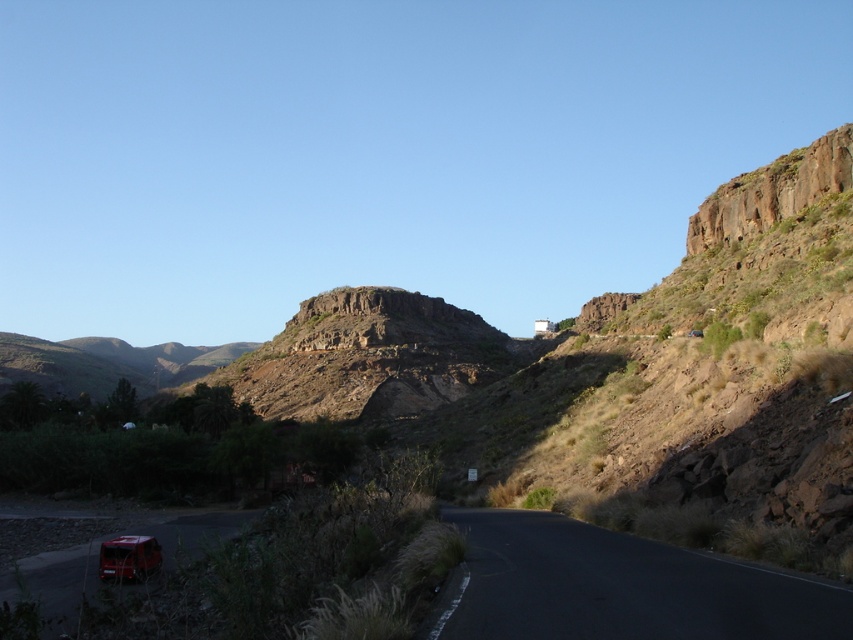
You are a delivery driver who needs to reach the metallic red car at lower left parked near the bushes. You are currently on the black asphalt road at lower right. Can you drive directly to the car without leaving the road?

The distance between the black asphalt road at lower right and metallic red car at lower left is 104.18 feet, so yes, you can drive directly to the metallic red car at lower left along the road since the road connects them.

You are a hiker planning to cross the black asphalt road at lower right while avoiding the metallic red car at lower left. Since the road is lower, can you safely walk over it without climbing?

The black asphalt road at lower right has a lesser height compared to the metallic red car at lower left, so yes, you can safely walk over the road without needing to climb since it is lower than the car.

You are a hiker trying to navigate through the arid landscape. You have two points marked on your map, point (560, 605) and point (138, 566). Which point is closer to your current position if you are standing at the starting point of the road?

Point (560, 605) is closer to the viewer than point (138, 566), so the hiker should head towards point (560, 605) first as it is nearer to their current position at the starting point of the road.